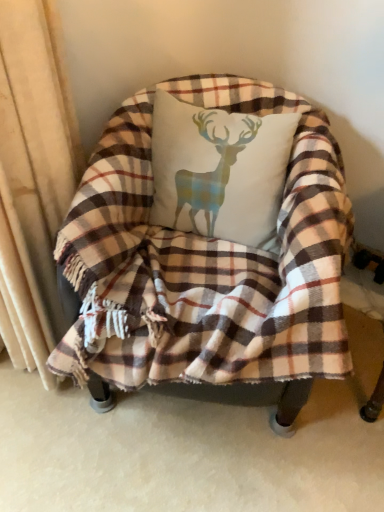
Question: Is white cotton cushion with deer print at center smaller than plaid fabric chair at center?

Choices:
 (A) no
 (B) yes

Answer: (B)

Question: Is white cotton cushion with deer print at center further to the viewer compared to plaid fabric chair at center?

Choices:
 (A) yes
 (B) no

Answer: (A)

Question: From a real-world perspective, is white cotton cushion with deer print at center beneath plaid fabric chair at center?

Choices:
 (A) yes
 (B) no

Answer: (B)

Question: Is white cotton cushion with deer print at center to the left of plaid fabric chair at center from the viewer's perspective?

Choices:
 (A) yes
 (B) no

Answer: (B)

Question: Is white cotton cushion with deer print at center not inside plaid fabric chair at center?

Choices:
 (A) no
 (B) yes

Answer: (A)

Question: Can you confirm if white cotton cushion with deer print at center is bigger than plaid fabric chair at center?

Choices:
 (A) no
 (B) yes

Answer: (A)

Question: Is plaid fabric chair at center positioned before white cotton cushion with deer print at center?

Choices:
 (A) no
 (B) yes

Answer: (B)

Question: Is plaid fabric chair at center at the left side of white cotton cushion with deer print at center?

Choices:
 (A) no
 (B) yes

Answer: (B)

Question: Can you confirm if plaid fabric chair at center is thinner than white cotton cushion with deer print at center?

Choices:
 (A) yes
 (B) no

Answer: (B)

Question: Is white cotton cushion with deer print at center completely or partially inside plaid fabric chair at center?

Choices:
 (A) yes
 (B) no

Answer: (A)

Question: From a real-world perspective, is plaid fabric chair at center under white cotton cushion with deer print at center?

Choices:
 (A) no
 (B) yes

Answer: (B)

Question: Does plaid fabric chair at center come behind white cotton cushion with deer print at center?

Choices:
 (A) no
 (B) yes

Answer: (A)

Question: Choose the correct answer: Is white cotton cushion with deer print at center inside plaid fabric chair at center or outside it?

Choices:
 (A) inside
 (B) outside

Answer: (A)